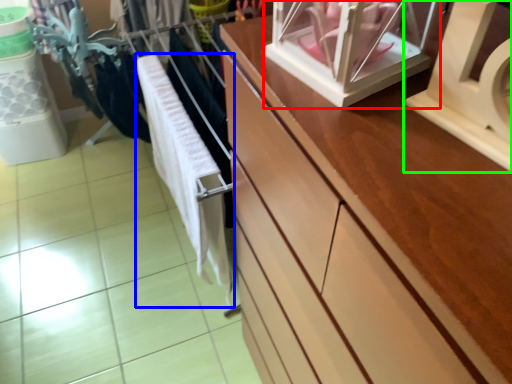
Question: Which object is positioned closest to glass box (highlighted by a red box)? Select from baby clothe (highlighted by a blue box) and wide (highlighted by a green box).

Choices:
 (A) baby clothe
 (B) wide

Answer: (B)